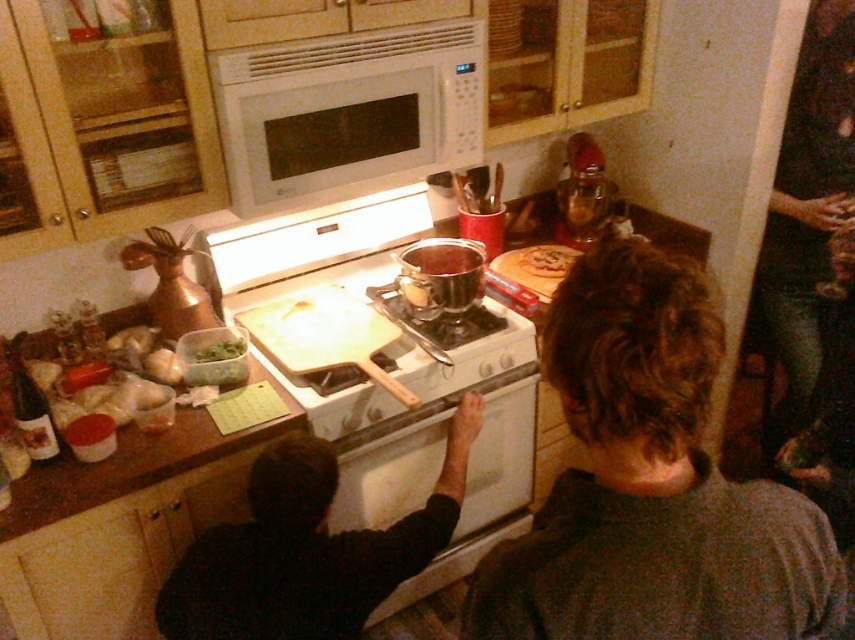
Question: Is dark brown hair at center below golden brown pastry at upper center?

Choices:
 (A) no
 (B) yes

Answer: (B)

Question: Is dark brown hair at center positioned behind golden brown pastry at upper center?

Choices:
 (A) yes
 (B) no

Answer: (B)

Question: Which point is closer to the camera?

Choices:
 (A) dark brown hair at center
 (B) green leafy vegetables at upper left

Answer: (A)

Question: Is dark brown hair at center to the left of white glossy oven at center from the viewer's perspective?

Choices:
 (A) yes
 (B) no

Answer: (B)

Question: Which point appears farthest from the camera in this image?

Choices:
 (A) (789, 248)
 (B) (213, 353)

Answer: (A)

Question: Which object is the farthest from the green leafy vegetables at upper left?

Choices:
 (A) golden brown pastry at upper center
 (B) white glossy oven at center

Answer: (A)